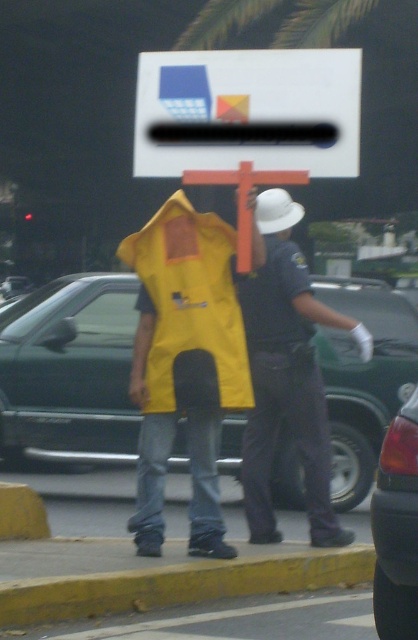
Consider the image. You are a pedestrian approaching the sidewalk where the matte plastic sign at center and the yellow matte safety vest at center are located. Which object is shorter?

The matte plastic sign at center is not as tall as the yellow matte safety vest at center, so the matte plastic sign at center is shorter.

You are a pedestrian who wants to cross the road where the metallic green car at center and the orange painted wooden cross at center are located. Which object is closer to you as you stand on the sidewalk?

The metallic green car at center is closer to you than the orange painted wooden cross at center because the orange painted wooden cross at center is positioned behind the metallic green car at center.